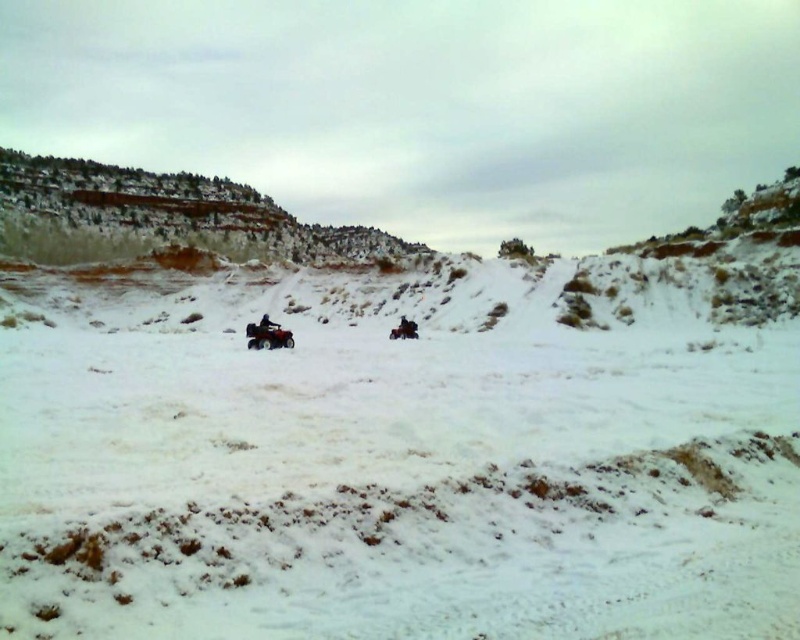
Question: Is rustic stone cliff at upper left positioned at the back of matte red snowmobile at center?

Choices:
 (A) no
 (B) yes

Answer: (B)

Question: Which object appears closest to the camera in this image?

Choices:
 (A) rustic stone cliff at upper left
 (B) matte red snowmobile at center
 (C) blue fabric jacket at center

Answer: (B)

Question: Which object is the closest to the matte red snowmobile at center?

Choices:
 (A) rustic stone cliff at upper left
 (B) blue fabric jacket at center

Answer: (B)

Question: Is matte red snowmobile at center smaller than blue fabric jacket at center?

Choices:
 (A) yes
 (B) no

Answer: (A)

Question: Does rustic stone cliff at upper left appear under blue fabric jacket at center?

Choices:
 (A) yes
 (B) no

Answer: (B)

Question: Which of the following is the closest to the observer?

Choices:
 (A) rustic stone cliff at upper left
 (B) matte red snowmobile at center

Answer: (B)